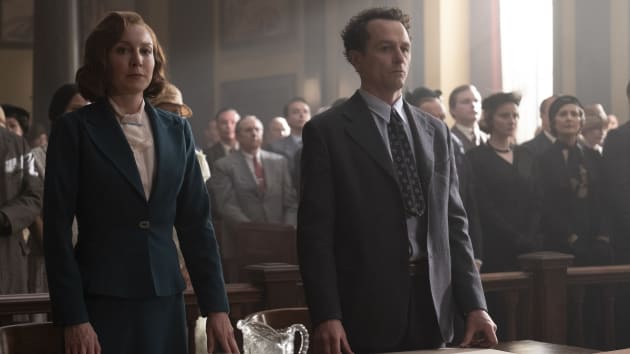
Where is `wooden partitions`? This screenshot has height=354, width=630. wooden partitions is located at coordinates (553, 300).